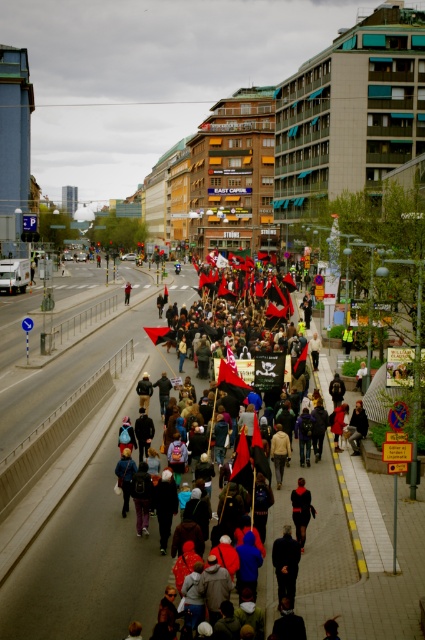
From the picture: You are a photographer standing at the edge of the road, wanting to capture both the dark red fabric flag at center and the dark blue jacket at center in a single frame. Your camera has a maximum zoom range that can capture objects up to 30 meters apart. Can you fit both subjects into your photo without moving closer?

The dark red fabric flag at center and dark blue jacket at center are 33.23 meters apart from each other, which exceeds the camera maximum zoom range of 30 meters. Therefore, you cannot fit both subjects into the photo without moving closer.

From the picture: You are standing at the edge of the street, observing the protest march. There are two points marked in the image. Which point, point (357, 560) or point (127, 282), is closer to your vantage point?

Point (357, 560) is closer to the viewer than point (127, 282).

You are a photographer standing at point (x=354, y=532). What object is directly in front of you?

The dark red fabric flag at center is directly in front of you at point (x=354, y=532).